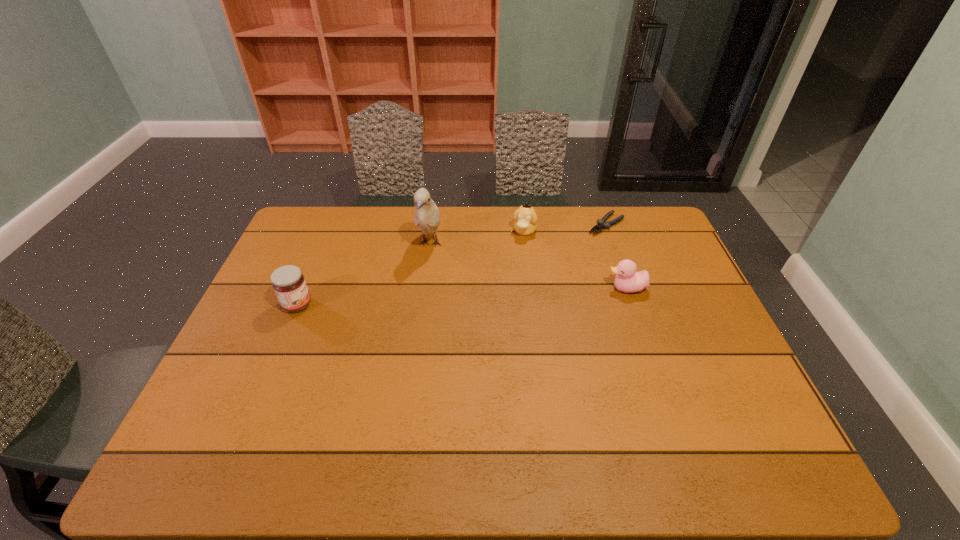
Locate an element on the screen. The height and width of the screenshot is (540, 960). free location located at the gripping part of the pliers is located at coordinates (522, 285).

Image resolution: width=960 pixels, height=540 pixels. Identify the location of duckling that is at the far edge. (525, 217).

Locate an element on the screen. The width and height of the screenshot is (960, 540). bird located at the far edge is located at coordinates (426, 216).

The height and width of the screenshot is (540, 960). Find the location of `pliers that is at the far edge`. pliers that is at the far edge is located at coordinates (601, 225).

Where is `object that is at the left edge`? object that is at the left edge is located at coordinates click(289, 284).

The width and height of the screenshot is (960, 540). What are the coordinates of `duckling at the right edge` in the screenshot? It's located at (627, 280).

Identify the location of pliers present at the right edge. (601, 225).

You are a GUI agent. You are given a task and a screenshot of the screen. Output one action in this format:
    pyautogui.click(x=<x>, y=<y>)
    Task: Click on the object that is positioned at the far right corner
    The width and height of the screenshot is (960, 540).
    Given the screenshot: What is the action you would take?
    pyautogui.click(x=601, y=225)

At what (x,y) coordinates should I click in order to perform the action: click on vacant position at the far edge of the desktop. Please return your answer as a coordinate pair (x, y). This screenshot has height=540, width=960. Looking at the image, I should click on (612, 228).

Image resolution: width=960 pixels, height=540 pixels. I want to click on free space at the near edge, so click(x=404, y=394).